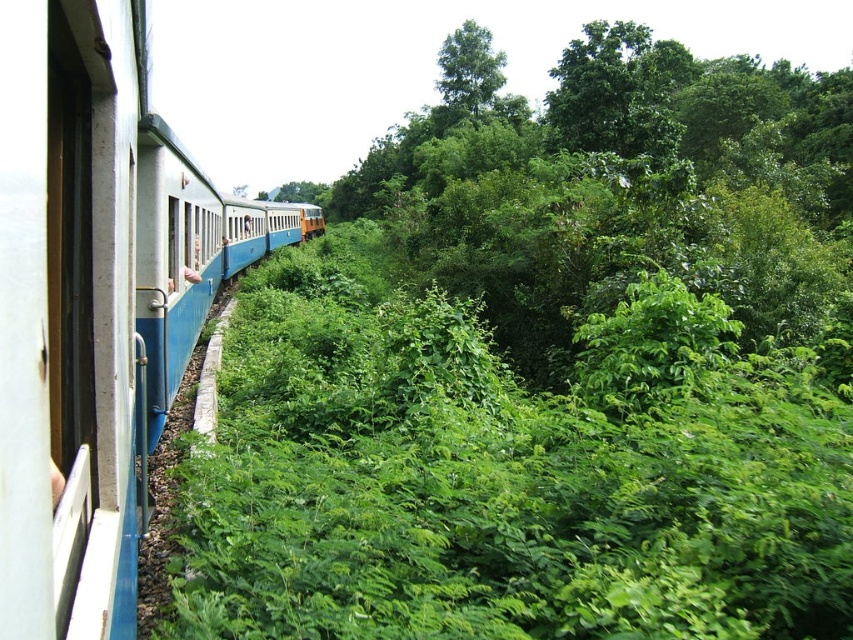
Question: Is green leafy tree at center in front of green leafy tree at upper center?

Choices:
 (A) no
 (B) yes

Answer: (B)

Question: Where is blue painted metal train at left located in relation to green leafy tree at upper center in the image?

Choices:
 (A) left
 (B) right

Answer: (A)

Question: Can you confirm if green leafy tree at center is positioned to the left of blue painted metal train at left?

Choices:
 (A) no
 (B) yes

Answer: (A)

Question: Which object is positioned farthest from the green leafy tree at center?

Choices:
 (A) green leafy tree at upper center
 (B) blue painted metal train at left

Answer: (A)

Question: Which of the following is the farthest from the observer?

Choices:
 (A) (22, 154)
 (B) (793, 227)
 (C) (477, 99)

Answer: (C)

Question: Which object appears farthest from the camera in this image?

Choices:
 (A) blue painted metal train at left
 (B) green leafy tree at center

Answer: (B)